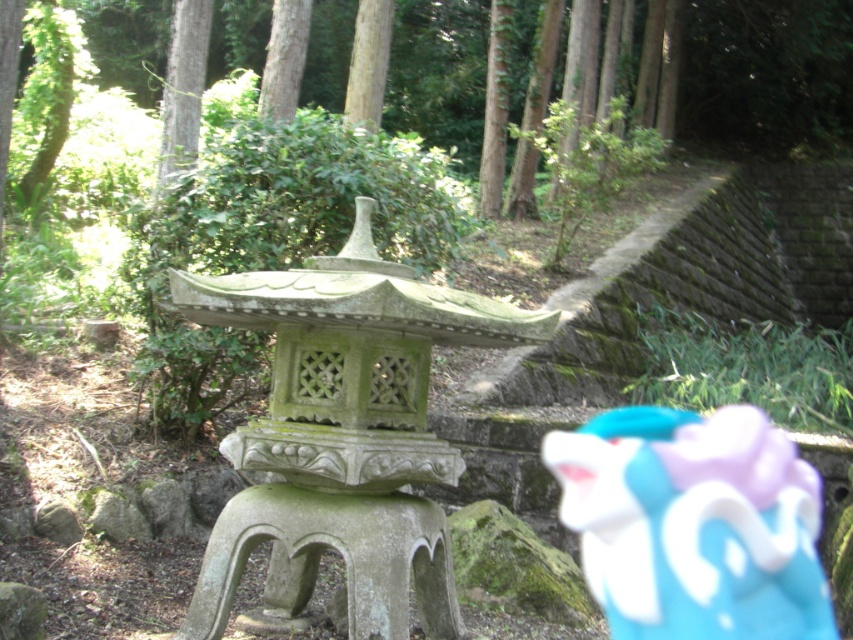
Question: Which object is the closest to the green stone lantern at center?

Choices:
 (A) green leafy tree at upper left
 (B) green rough bark tree at upper left
 (C) smooth bark tree at upper center
 (D) green stone stool at center

Answer: (D)

Question: Considering the real-world distances, which object is closest to the smooth bark tree at upper center?

Choices:
 (A) smooth brown tree trunk at upper center
 (B) green leafy tree at upper left
 (C) matte plastic toy at center

Answer: (A)

Question: Where is green stone stool at center located in relation to green leafy tree at upper left in the image?

Choices:
 (A) above
 (B) below

Answer: (B)

Question: Does green stone stool at center appear on the left side of smooth bark tree at upper center?

Choices:
 (A) no
 (B) yes

Answer: (A)

Question: From the image, what is the correct spatial relationship of green stone lantern at center in relation to smooth bark tree at upper center?

Choices:
 (A) right
 (B) left

Answer: (A)

Question: Estimate the real-world distances between objects in this image. Which object is farther from the green leafy tree at upper left?

Choices:
 (A) green stone stool at center
 (B) green stone lantern at center
 (C) green rough bark tree at upper left
 (D) smooth bark tree at upper center

Answer: (A)